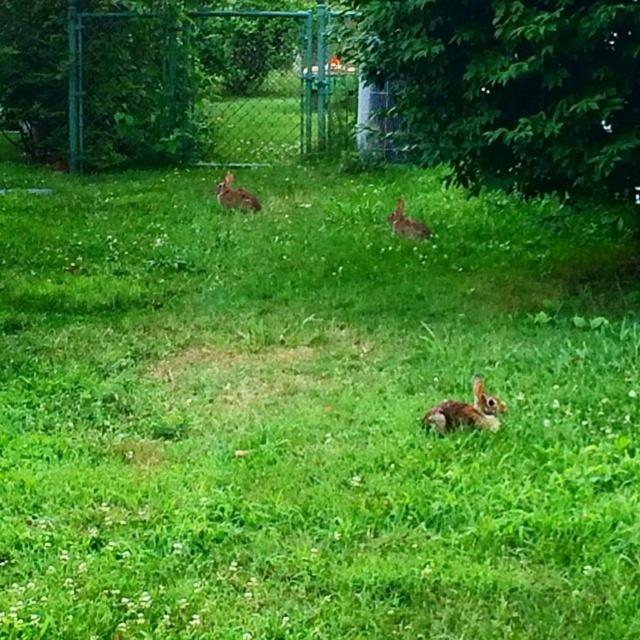
Question: Can you confirm if green chain-link fence at upper center is wider than brown furry rabbit at lower center?

Choices:
 (A) yes
 (B) no

Answer: (A)

Question: Which is farther from the brown furry rabbit at center?

Choices:
 (A) brown furry rabbit at lower center
 (B) brown furry rabbit at upper center

Answer: (A)

Question: Does brown furry rabbit at lower center appear on the left side of brown furry rabbit at center?

Choices:
 (A) no
 (B) yes

Answer: (A)

Question: Does brown furry rabbit at upper center appear under brown furry rabbit at center?

Choices:
 (A) yes
 (B) no

Answer: (B)

Question: Which point is closer to the camera taking this photo?

Choices:
 (A) (472, 385)
 (B) (397, 198)

Answer: (A)

Question: Which object appears closest to the camera in this image?

Choices:
 (A) brown furry rabbit at center
 (B) brown furry rabbit at upper center
 (C) green chain-link fence at upper center
 (D) brown furry rabbit at lower center

Answer: (D)